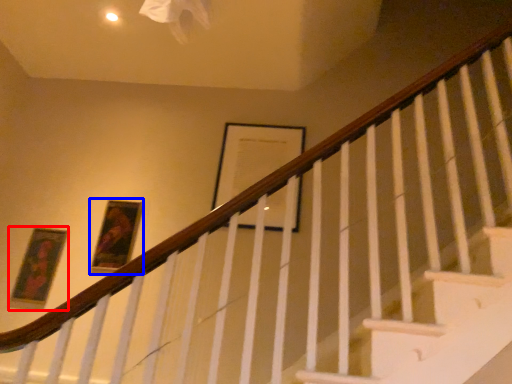
Question: Which point is further to the camera, picture frame (highlighted by a red box) or picture frame (highlighted by a blue box)?

Choices:
 (A) picture frame
 (B) picture frame

Answer: (B)